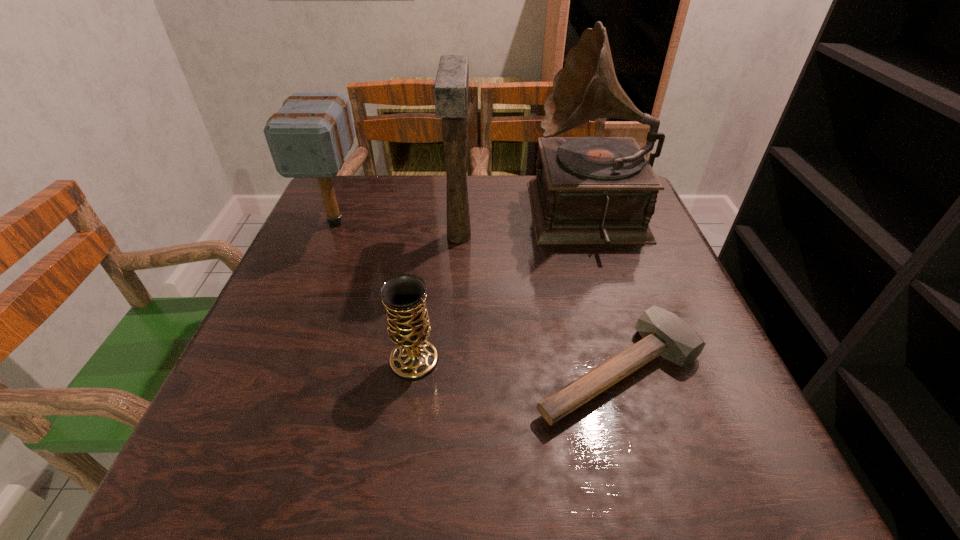
Image resolution: width=960 pixels, height=540 pixels. In the image, there is a desktop. Identify the location of vacant space at the far edge. (380, 207).

Find the location of a particular element. This screenshot has width=960, height=540. vacant space at the near edge of the desktop is located at coordinates (402, 436).

Identify the location of vacant space at the left edge of the desktop. (320, 333).

Where is `free space at the right edge`? Image resolution: width=960 pixels, height=540 pixels. free space at the right edge is located at coordinates (638, 246).

Identify the location of blank space at the near left corner of the desktop. (x=297, y=437).

This screenshot has height=540, width=960. In the image, there is a desktop. Find the location of `vacant region at the near right corner`. vacant region at the near right corner is located at coordinates (777, 467).

Find the location of a particular element. blank region between the chalice and the nearest mallet is located at coordinates (516, 365).

Identify the location of vacant area between the nearest mallet and the second mallet from right to left. The image size is (960, 540). (539, 304).

Locate an element on the screen. This screenshot has width=960, height=540. free space that is in between the chalice and the record player is located at coordinates (502, 288).

The image size is (960, 540). What are the coordinates of `vacant area that lies between the shortest object and the leftmost mallet` in the screenshot? It's located at (477, 296).